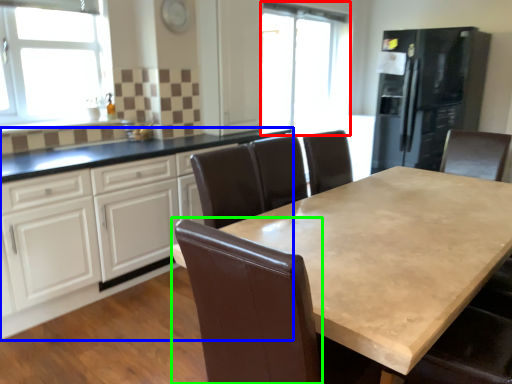
Question: Which object is positioned closest to window screen (highlighted by a red box)? Select from cabinetry (highlighted by a blue box) and swivel chair (highlighted by a green box).

Choices:
 (A) cabinetry
 (B) swivel chair

Answer: (A)